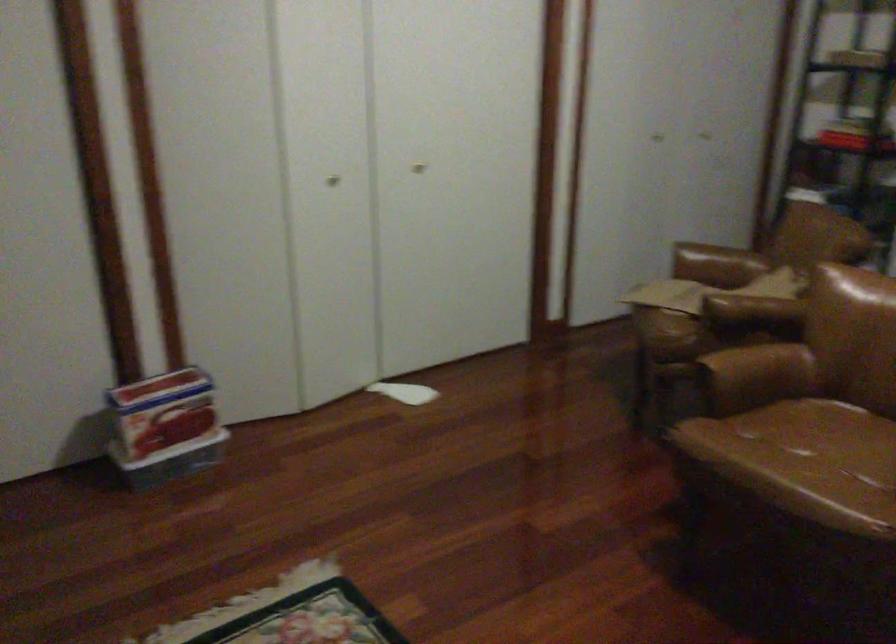
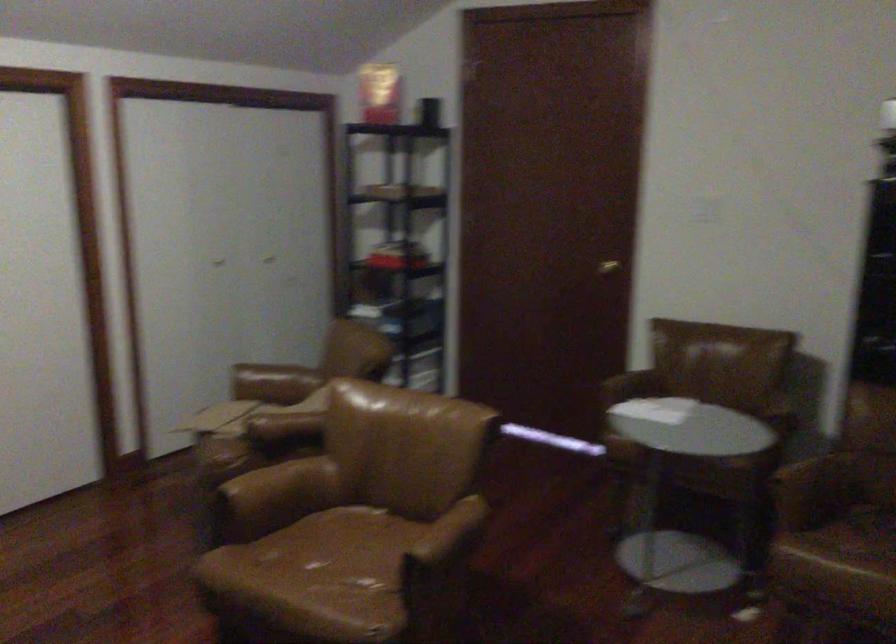
The point at (737,305) is marked in the first image. Where is the corresponding point in the second image?

(283, 426)